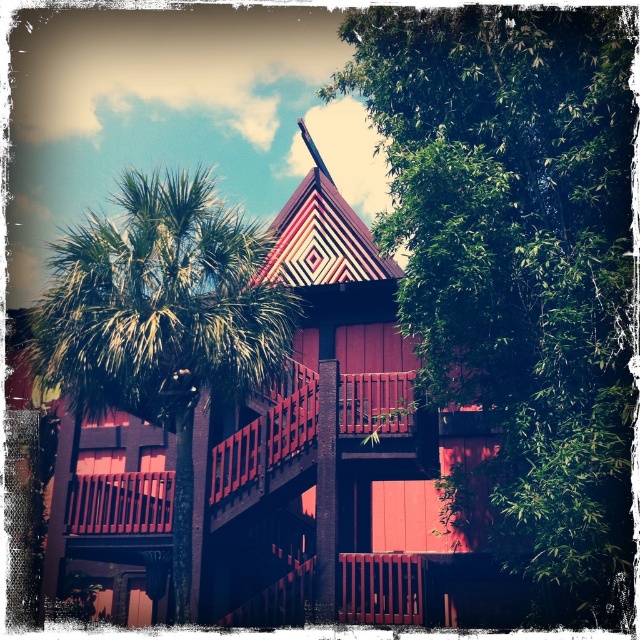
Who is positioned more to the right, green leafy tree at upper right or green leafy palm tree at left?

Positioned to the right is green leafy tree at upper right.

Is the position of green leafy tree at upper right less distant than that of green leafy palm tree at left?

Yes, green leafy tree at upper right is in front of green leafy palm tree at left.

Does point (572, 60) come in front of point (248, 240)?

Yes, it is.

The image size is (640, 640). What are the coordinates of `green leafy tree at upper right` in the screenshot? It's located at (518, 259).